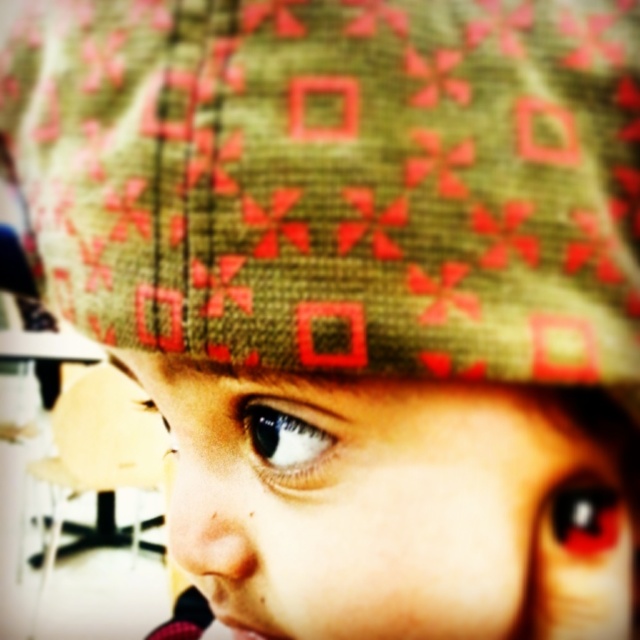
You are an optometrist examining a patient. You notice two eyes in the image, the black glossy eye at center and the shiny blue eye at center. Which eye is taller?

The black glossy eye at center is taller than the shiny blue eye at center according to the description.